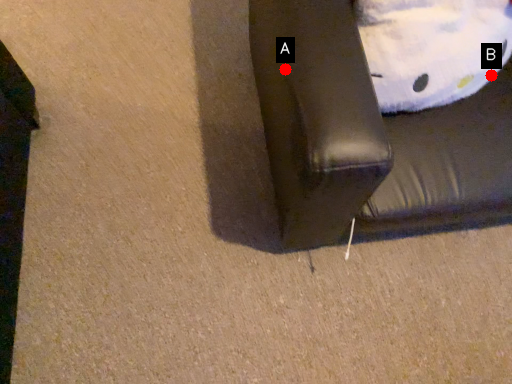
Question: Two points are circled on the image, labeled by A and B beside each circle. Which point is farther to the camera?

Choices:
 (A) A is further
 (B) B is further

Answer: (B)